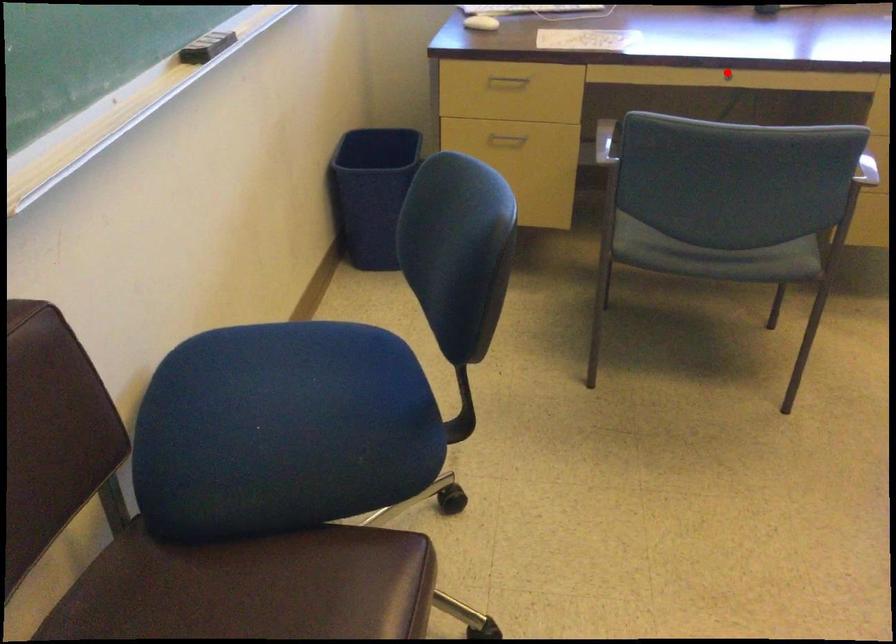
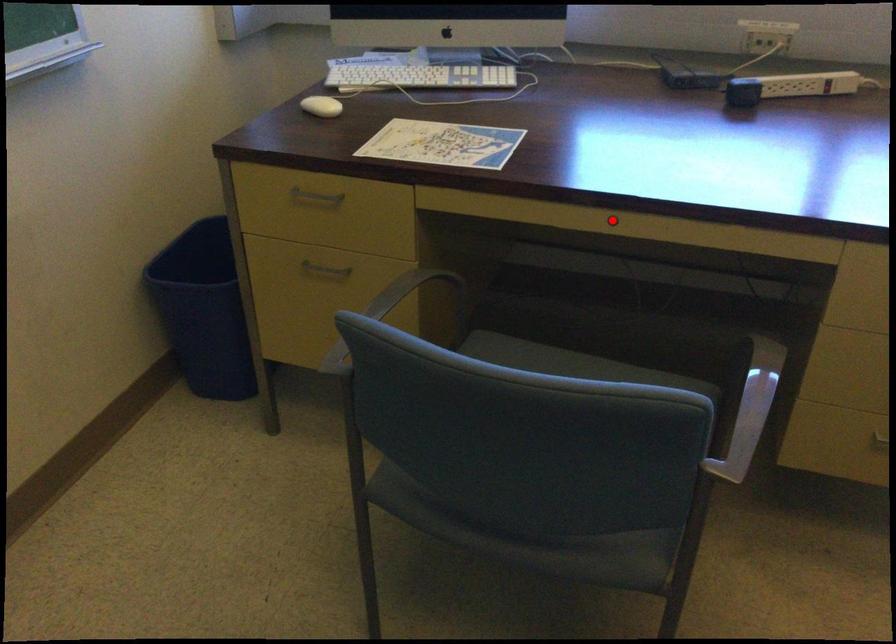
Consider the image. I am providing you with two images of the same scene from different viewpoints. A red point is marked on the first image and another point is marked on the second image. Is the marked point in image1 the same physical position as the marked point in image2?

Yes